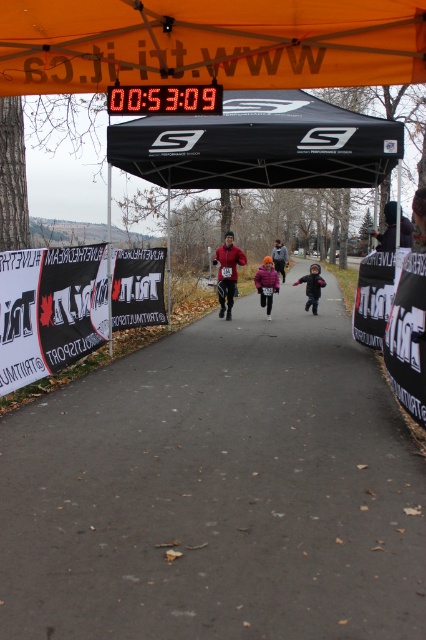
Question: Is gray asphalt path at center to the left of dark gray hoodie at center from the viewer's perspective?

Choices:
 (A) no
 (B) yes

Answer: (B)

Question: Which of the following is the closest to the observer?

Choices:
 (A) (264, 275)
 (B) (279, 260)

Answer: (A)

Question: Which of the following is the farthest from the observer?

Choices:
 (A) orange fabric canopy at upper center
 (B) dark blue jacket at center

Answer: (B)

Question: Can you confirm if orange fabric canopy at upper center is positioned above dark blue jacket at center?

Choices:
 (A) yes
 (B) no

Answer: (A)

Question: Which object is closer to the camera taking this photo?

Choices:
 (A) black fabric tent at center
 (B) dark blue jacket at center
 (C) matte red jacket at center
 (D) orange fleece jacket at center

Answer: (A)

Question: Does matte red jacket at center have a larger size compared to dark gray hoodie at center?

Choices:
 (A) no
 (B) yes

Answer: (A)